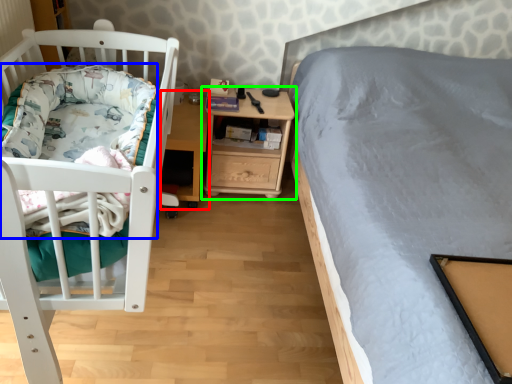
Question: Which object is the closest to the table (highlighted by a red box)? Choose among these: blanket (highlighted by a blue box) or nightstand (highlighted by a green box).

Choices:
 (A) blanket
 (B) nightstand

Answer: (B)